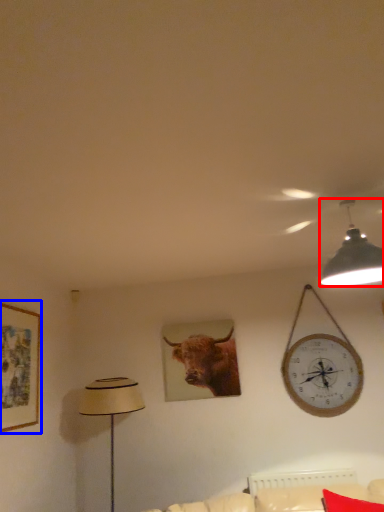
Question: Which object appears closest to the camera in this image, lamp (highlighted by a red box) or picture frame (highlighted by a blue box)?

Choices:
 (A) lamp
 (B) picture frame

Answer: (A)